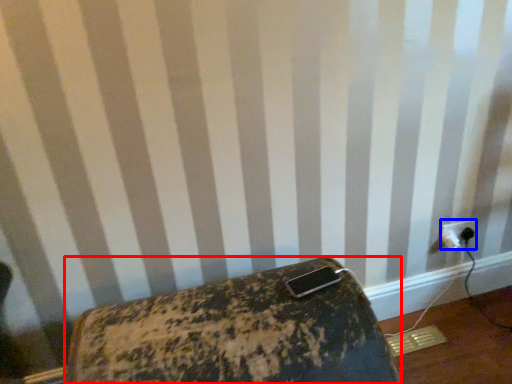
Question: Which object is closer to the camera taking this photo, furniture (highlighted by a red box) or power plugs and sockets (highlighted by a blue box)?

Choices:
 (A) furniture
 (B) power plugs and sockets

Answer: (A)